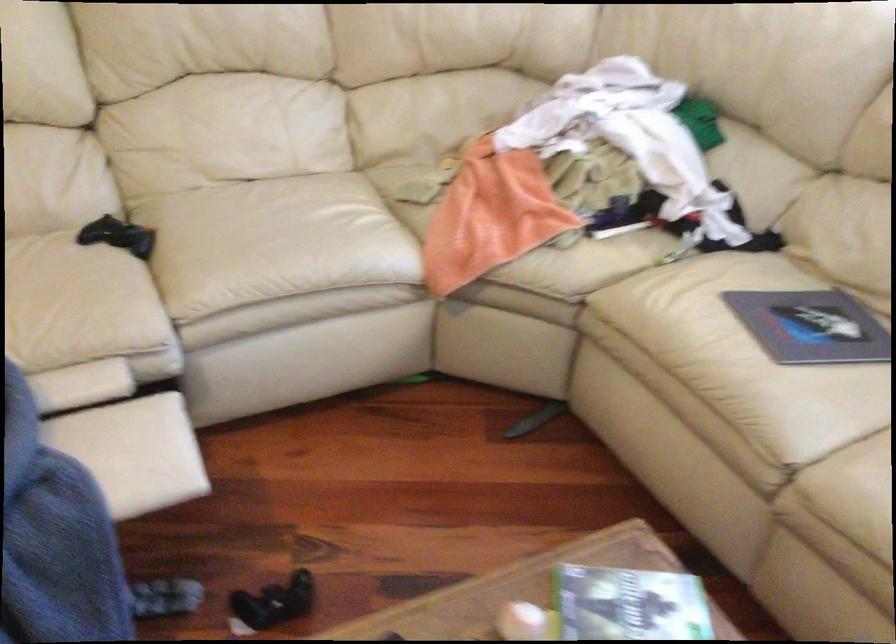
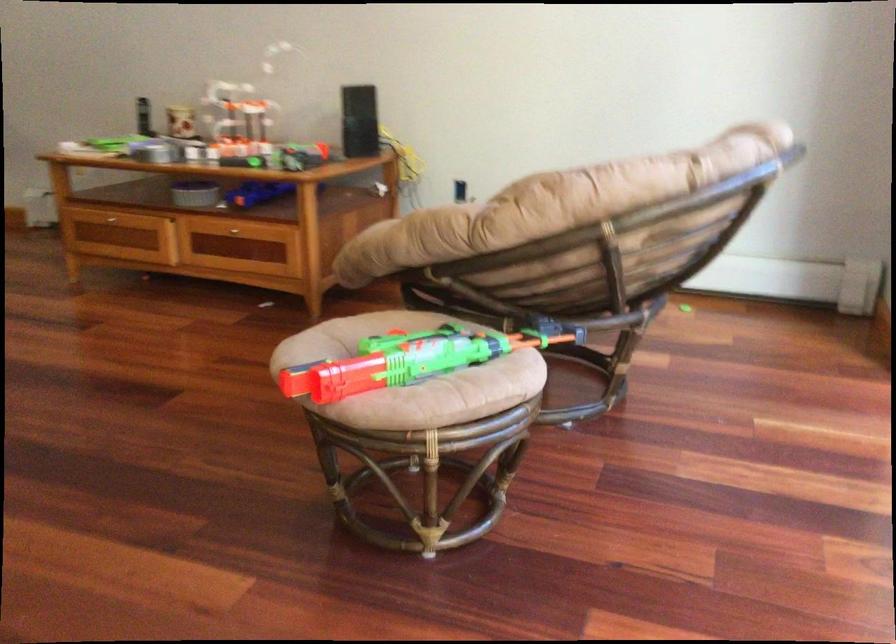
What movement of the cameraman would produce the second image?

The movement direction of the cameraman is right, forward.